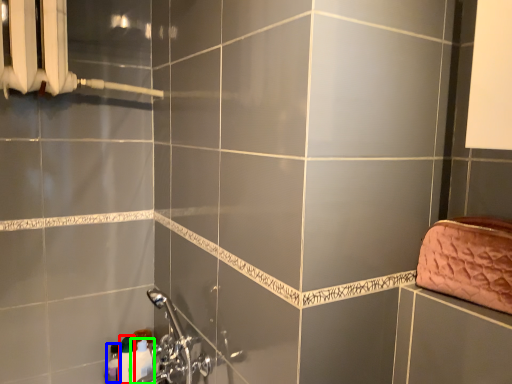
Question: Estimate the real-world distances between objects in this image. Which object is farther from toiletry (highlighted by a red box), toiletry (highlighted by a blue box) or toiletry (highlighted by a green box)?

Choices:
 (A) toiletry
 (B) toiletry

Answer: (B)